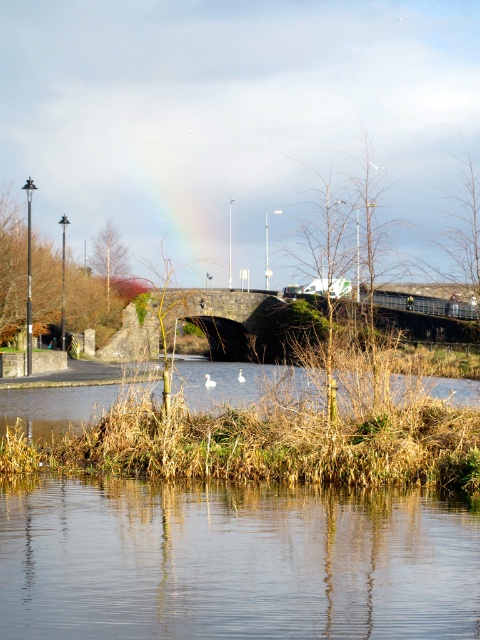
You are standing on the stone bridge and want to cross to the other side. You see the transparent water at center and the brown grassy river at lower center. Which one is lower in height and would require fewer steps to step over?

The transparent water at center has a lesser height compared to brown grassy river at lower center, so you would need fewer steps to step over the transparent water at center.

You are standing at the point marked by the coordinates point (236, 561). Looking around, you see the transparent water at center and the stone bridge in the midground. Which object is closer to you?

The transparent water at center is closer to you because it is at the point marked by the coordinates point (236, 561).

You are standing at the riverside and want to take a photo of both the transparent water at center and the brown grassy river at lower center. Which object should you focus on first to ensure both are in sharp focus?

The transparent water at center is closer to the viewer than the brown grassy river at lower center. To ensure both are in sharp focus, you should focus on the transparent water at center first, as it is the closer object.